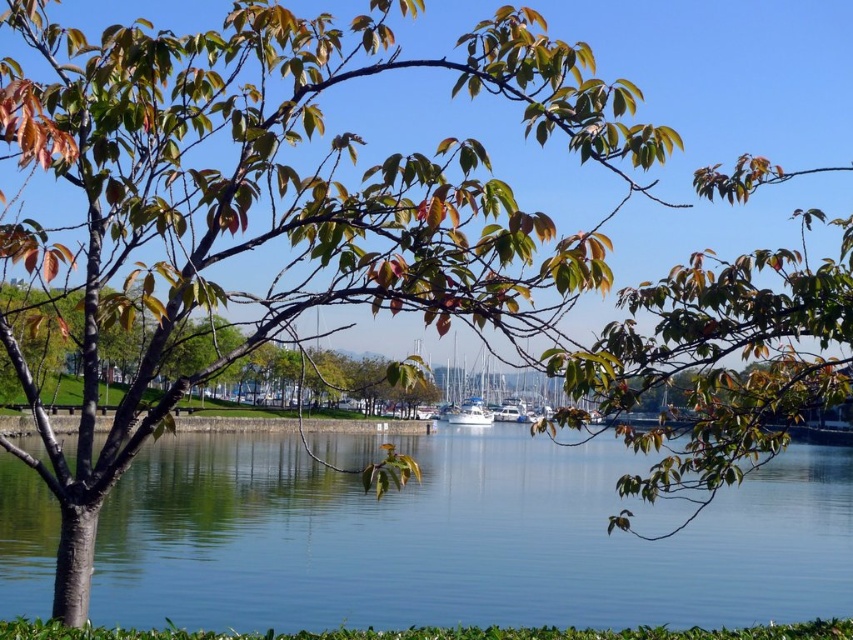
Who is positioned more to the right, clear blue water at center or green matte tree at center?

clear blue water at center

Does point (592, 492) lie behind point (117, 346)?

Yes, it is.

Where is `clear blue water at center`? The width and height of the screenshot is (853, 640). clear blue water at center is located at coordinates (457, 538).

Is point (42, 577) more distant than point (468, 406)?

No, it is not.

You are a GUI agent. You are given a task and a screenshot of the screen. Output one action in this format:
    pyautogui.click(x=<x>, y=<y>)
    Task: Click on the clear blue water at center
    The height and width of the screenshot is (640, 853).
    Given the screenshot: What is the action you would take?
    click(x=457, y=538)

Who is more distant from viewer, (59, 310) or (486, 413)?

The point (486, 413) is behind.

What do you see at coordinates (48, 340) in the screenshot? The height and width of the screenshot is (640, 853). I see `green matte tree at center` at bounding box center [48, 340].

Is point (177, 376) positioned in front of point (447, 376)?

Yes, it is.

Locate an element on the screen. The height and width of the screenshot is (640, 853). green matte tree at center is located at coordinates (48, 340).